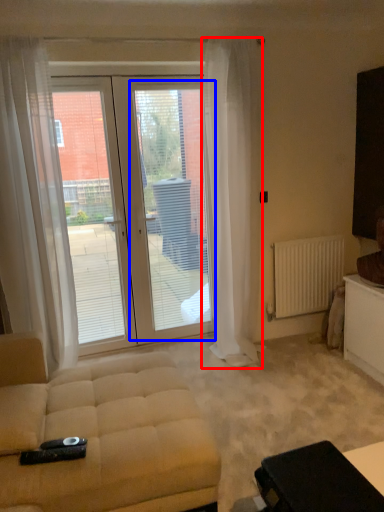
Question: Which object appears farthest to the camera in this image, curtain (highlighted by a red box) or screen door (highlighted by a blue box)?

Choices:
 (A) curtain
 (B) screen door

Answer: (B)